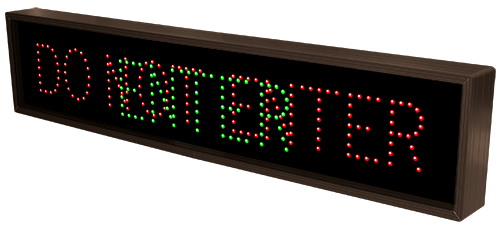
This screenshot has height=229, width=500. Identify the location of red lights (circles). (239, 105).